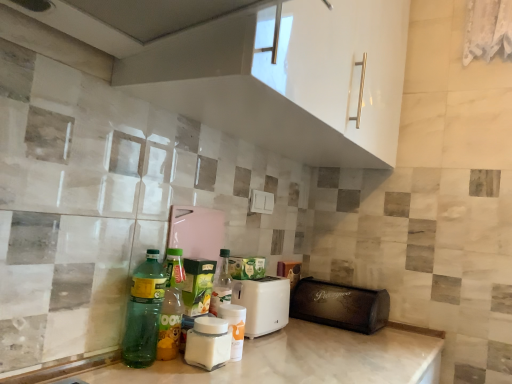
Locate an element on the screen. The height and width of the screenshot is (384, 512). white plastic toaster at center, which ranks as the first appliance in left-to-right order is located at coordinates (263, 304).

Describe the element at coordinates (144, 312) in the screenshot. I see `green translucent bottle at lower left, the 1th bottle when ordered from left to right` at that location.

Where is `white glossy jar at center, placed as the fourth bottle when sorted from left to right`? This screenshot has width=512, height=384. white glossy jar at center, placed as the fourth bottle when sorted from left to right is located at coordinates (234, 327).

The height and width of the screenshot is (384, 512). In order to click on white plastic toaster at center, the second appliance viewed from the right in this screenshot , I will do `click(263, 304)`.

Where is `the 4th bottle in front of the black leather bread bin at lower right, the first appliance from the right`? The image size is (512, 384). the 4th bottle in front of the black leather bread bin at lower right, the first appliance from the right is located at coordinates (144, 312).

Is green translucent bottle at lower left, which is counted as the fourth bottle, starting from the right, outside of black leather bread bin at lower right, the first appliance from the right?

Absolutely, green translucent bottle at lower left, which is counted as the fourth bottle, starting from the right, is external to black leather bread bin at lower right, the first appliance from the right.

Can you confirm if green translucent bottle at lower left, which is counted as the fourth bottle, starting from the right, is taller than black leather bread bin at lower right, the first appliance from the right?

Correct, green translucent bottle at lower left, which is counted as the fourth bottle, starting from the right, is much taller as black leather bread bin at lower right, the first appliance from the right.

What's the angular difference between green translucent bottle at lower left, the 1th bottle when ordered from left to right, and black leather bread bin at lower right, placed as the 2th appliance when sorted from left to right,'s facing directions?

The angle between the facing direction of green translucent bottle at lower left, the 1th bottle when ordered from left to right, and the facing direction of black leather bread bin at lower right, placed as the 2th appliance when sorted from left to right, is 98.3 degrees.

Does point (246, 304) come behind point (219, 351)?

Yes, point (246, 304) is behind point (219, 351).

There is a white plastic toaster at center, the second appliance viewed from the right. Where is `the 1st bottle above it (from the image's perspective)`? the 1st bottle above it (from the image's perspective) is located at coordinates (208, 343).

Can you confirm if white plastic toaster at center, the second appliance viewed from the right, is positioned to the left of white glossy jar at center, the 2th bottle viewed from the right?

In fact, white plastic toaster at center, the second appliance viewed from the right, is to the right of white glossy jar at center, the 2th bottle viewed from the right.

Is white plastic toaster at center, which ranks as the first appliance in left-to-right order, looking in the opposite direction of white glossy jar at center, the third bottle when ordered from left to right?

No, white plastic toaster at center, which ranks as the first appliance in left-to-right order, is not facing the opposite direction of white glossy jar at center, the third bottle when ordered from left to right.

Does black leather bread bin at lower right, placed as the 2th appliance when sorted from left to right, have a larger size compared to white glossy jar at center, marked as the first bottle in a right-to-left arrangement?

Indeed, black leather bread bin at lower right, placed as the 2th appliance when sorted from left to right, has a larger size compared to white glossy jar at center, marked as the first bottle in a right-to-left arrangement.

From a real-world perspective, count 1st bottles downward from the black leather bread bin at lower right, placed as the 2th appliance when sorted from left to right, and point to it. Please provide its 2D coordinates.

[(234, 327)]

How distant is black leather bread bin at lower right, placed as the 2th appliance when sorted from left to right, from white glossy jar at center, marked as the first bottle in a right-to-left arrangement?

black leather bread bin at lower right, placed as the 2th appliance when sorted from left to right, is 22.43 inches from white glossy jar at center, marked as the first bottle in a right-to-left arrangement.

Considering the sizes of objects black leather bread bin at lower right, the first appliance from the right, and white glossy jar at center, marked as the first bottle in a right-to-left arrangement, in the image provided, who is thinner, black leather bread bin at lower right, the first appliance from the right, or white glossy jar at center, marked as the first bottle in a right-to-left arrangement,?

white glossy jar at center, marked as the first bottle in a right-to-left arrangement.

Can you tell me how much black leather bread bin at lower right, the first appliance from the right, and green translucent bottle at lower left, which is counted as the fourth bottle, starting from the right, differ in facing direction?

The facing directions of black leather bread bin at lower right, the first appliance from the right, and green translucent bottle at lower left, which is counted as the fourth bottle, starting from the right, are 98.3 degrees apart.

Measure the distance between black leather bread bin at lower right, placed as the 2th appliance when sorted from left to right, and green translucent bottle at lower left, the 1th bottle when ordered from left to right.

black leather bread bin at lower right, placed as the 2th appliance when sorted from left to right, is 76.50 centimeters from green translucent bottle at lower left, the 1th bottle when ordered from left to right.

In the scene shown: From a real-world perspective, is black leather bread bin at lower right, the first appliance from the right, physically below green translucent bottle at lower left, which is counted as the fourth bottle, starting from the right?

Yes.

Who is bigger, black leather bread bin at lower right, placed as the 2th appliance when sorted from left to right, or green translucent bottle at lower left, which is counted as the fourth bottle, starting from the right?

Bigger between the two is black leather bread bin at lower right, placed as the 2th appliance when sorted from left to right.

From the image's perspective, is green glass bottle at center, positioned as the 3th bottle in right-to-left order, located above or below white glossy jar at center, the 2th bottle viewed from the right?

green glass bottle at center, positioned as the 3th bottle in right-to-left order, is above white glossy jar at center, the 2th bottle viewed from the right.

From the picture: Which point is more forward, (x=177, y=351) or (x=227, y=329)?

Positioned in front is point (x=227, y=329).

In the scene shown: In terms of height, does green glass bottle at center, positioned as the 3th bottle in right-to-left order, look taller or shorter compared to white glossy jar at center, the 2th bottle viewed from the right?

green glass bottle at center, positioned as the 3th bottle in right-to-left order, is taller than white glossy jar at center, the 2th bottle viewed from the right.

What's the angular difference between green glass bottle at center, positioned as the 3th bottle in right-to-left order, and white glossy jar at center, the third bottle when ordered from left to right,'s facing directions?

The angular difference between green glass bottle at center, positioned as the 3th bottle in right-to-left order, and white glossy jar at center, the third bottle when ordered from left to right, is 5.63 degrees.

Considering the positions of point (211, 329) and point (226, 318), is point (211, 329) closer or farther from the camera than point (226, 318)?

Point (211, 329) appears to be closer to the viewer than point (226, 318).

From a real-world perspective, count 1st bottles upward from the white glossy jar at center, the third bottle when ordered from left to right, and point to it. Please provide its 2D coordinates.

[(234, 327)]

Is white glossy jar at center, the third bottle when ordered from left to right, positioned with its back to white glossy jar at center, marked as the first bottle in a right-to-left arrangement?

white glossy jar at center, the third bottle when ordered from left to right, is not turned away from white glossy jar at center, marked as the first bottle in a right-to-left arrangement.

Visually, is white glossy jar at center, the third bottle when ordered from left to right, positioned to the left or to the right of white glossy jar at center, marked as the first bottle in a right-to-left arrangement?

white glossy jar at center, the third bottle when ordered from left to right, is to the left of white glossy jar at center, marked as the first bottle in a right-to-left arrangement.

Can you confirm if white glossy jar at center, the third bottle when ordered from left to right, is bigger than black leather bread bin at lower right, placed as the 2th appliance when sorted from left to right?

Actually, white glossy jar at center, the third bottle when ordered from left to right, might be smaller than black leather bread bin at lower right, placed as the 2th appliance when sorted from left to right.

Can you confirm if white glossy jar at center, the third bottle when ordered from left to right, is positioned to the left of black leather bread bin at lower right, placed as the 2th appliance when sorted from left to right?

Yes.

Measure the distance from white glossy jar at center, the third bottle when ordered from left to right, to black leather bread bin at lower right, placed as the 2th appliance when sorted from left to right.

65.56 centimeters.

Looking at their sizes, would you say white glossy jar at center, the third bottle when ordered from left to right, is wider or thinner than black leather bread bin at lower right, the first appliance from the right?

white glossy jar at center, the third bottle when ordered from left to right, is thinner than black leather bread bin at lower right, the first appliance from the right.

Starting from the green translucent bottle at lower left, the 1th bottle when ordered from left to right, which appliance is the 2nd one behind? Please provide its 2D coordinates.

[(340, 305)]

Identify the location of bottle that is the 3rd one when counting forward from the white plastic toaster at center, which ranks as the first appliance in left-to-right order. (208, 343).

Considering their positions, is black leather bread bin at lower right, placed as the 2th appliance when sorted from left to right, positioned closer to white glossy jar at center, the third bottle when ordered from left to right, than white glossy jar at center, placed as the fourth bottle when sorted from left to right?

Based on the image, white glossy jar at center, placed as the fourth bottle when sorted from left to right, appears to be nearer to white glossy jar at center, the third bottle when ordered from left to right.

From the image, which object appears to be nearer to white glossy jar at center, marked as the first bottle in a right-to-left arrangement, green translucent bottle at lower left, which is counted as the fourth bottle, starting from the right, or white plastic toaster at center, which ranks as the first appliance in left-to-right order?

Based on the image, white plastic toaster at center, which ranks as the first appliance in left-to-right order, appears to be nearer to white glossy jar at center, marked as the first bottle in a right-to-left arrangement.

Estimate the real-world distances between objects in this image. Which object is closer to black leather bread bin at lower right, the first appliance from the right, green translucent bottle at lower left, the 1th bottle when ordered from left to right, or white glossy jar at center, placed as the fourth bottle when sorted from left to right?

white glossy jar at center, placed as the fourth bottle when sorted from left to right.

Looking at the image, which one is located closer to green translucent bottle at lower left, which is counted as the fourth bottle, starting from the right, white glossy jar at center, marked as the first bottle in a right-to-left arrangement, or white glossy jar at center, the 2th bottle viewed from the right?

The object closer to green translucent bottle at lower left, which is counted as the fourth bottle, starting from the right, is white glossy jar at center, the 2th bottle viewed from the right.

From the picture: Estimate the real-world distances between objects in this image. Which object is further from white glossy jar at center, placed as the fourth bottle when sorted from left to right, white glossy jar at center, the third bottle when ordered from left to right, or black leather bread bin at lower right, the first appliance from the right?

black leather bread bin at lower right, the first appliance from the right, lies further to white glossy jar at center, placed as the fourth bottle when sorted from left to right, than the other object.

When comparing their distances from white glossy jar at center, the third bottle when ordered from left to right, does green glass bottle at center, positioned as the 3th bottle in right-to-left order, or white glossy jar at center, marked as the first bottle in a right-to-left arrangement, seem closer?

The object closer to white glossy jar at center, the third bottle when ordered from left to right, is white glossy jar at center, marked as the first bottle in a right-to-left arrangement.

Estimate the real-world distances between objects in this image. Which object is further from white plastic toaster at center, which ranks as the first appliance in left-to-right order, white glossy jar at center, marked as the first bottle in a right-to-left arrangement, or black leather bread bin at lower right, placed as the 2th appliance when sorted from left to right?

Among the two, black leather bread bin at lower right, placed as the 2th appliance when sorted from left to right, is located further to white plastic toaster at center, which ranks as the first appliance in left-to-right order.

Looking at the image, which one is located closer to white glossy jar at center, the 2th bottle viewed from the right, green translucent bottle at lower left, which is counted as the fourth bottle, starting from the right, or green glass bottle at center, positioned as the 3th bottle in right-to-left order?

green glass bottle at center, positioned as the 3th bottle in right-to-left order.

Find the location of a particular element. Image resolution: width=512 pixels, height=384 pixels. appliance between white glossy jar at center, marked as the first bottle in a right-to-left arrangement, and black leather bread bin at lower right, the first appliance from the right is located at coordinates (263, 304).

This screenshot has width=512, height=384. I want to click on bottle located between green glass bottle at center, which is the 2th bottle from left to right, and white plastic toaster at center, the second appliance viewed from the right, in the depth direction, so click(234, 327).

The width and height of the screenshot is (512, 384). What are the coordinates of `bottle located between green glass bottle at center, positioned as the 3th bottle in right-to-left order, and white glossy jar at center, marked as the first bottle in a right-to-left arrangement, in the left-right direction` in the screenshot? It's located at (208, 343).

The width and height of the screenshot is (512, 384). I want to click on appliance between green glass bottle at center, which is the 2th bottle from left to right, and black leather bread bin at lower right, the first appliance from the right, from left to right, so click(263, 304).